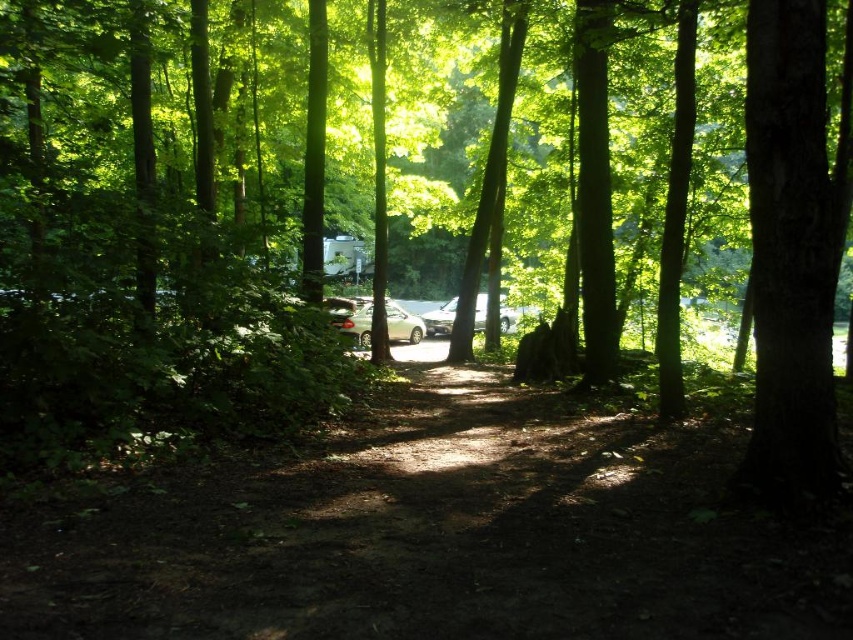
You are standing at the point labeled point (814, 196) in the forest scene. You want to walk towards the point labeled point (432, 326). Will you be moving closer to or farther away from the camera as you walk?

As you walk from point (814, 196) to point (432, 326) in the forest scene, you will be moving farther away from the camera because point (432, 326) is farther from the camera compared to point (814, 196).